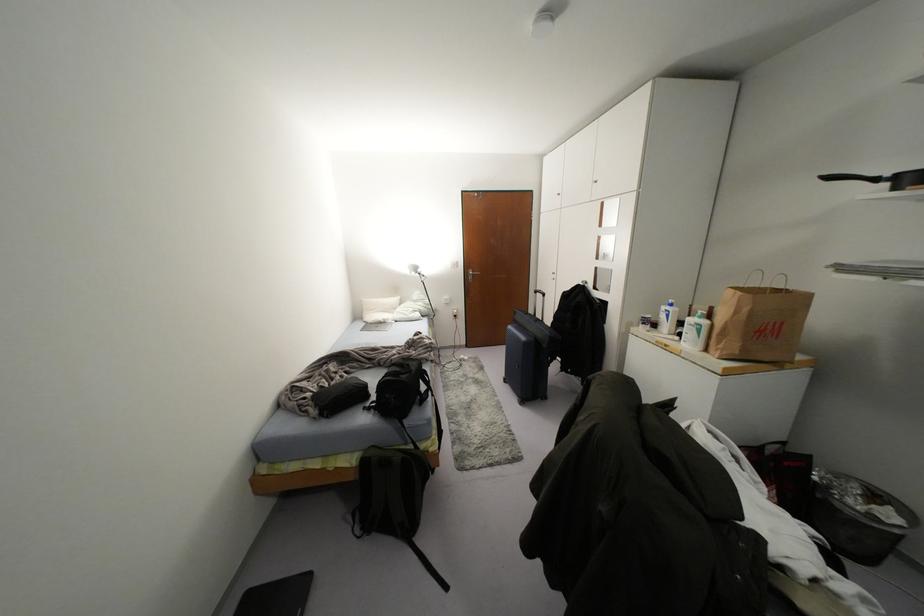
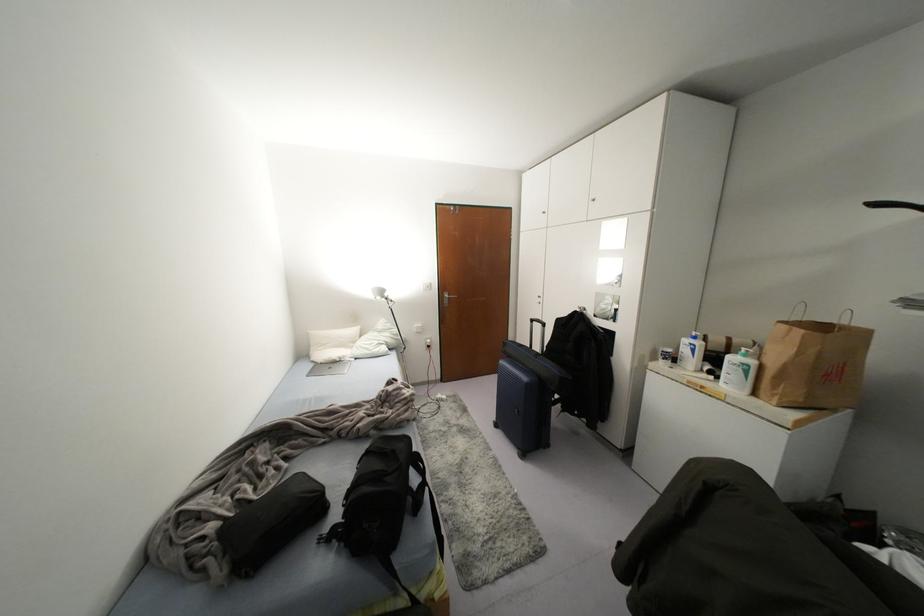
Find the pixel in the second image that matches pixel 419 270 in the first image.

(385, 294)